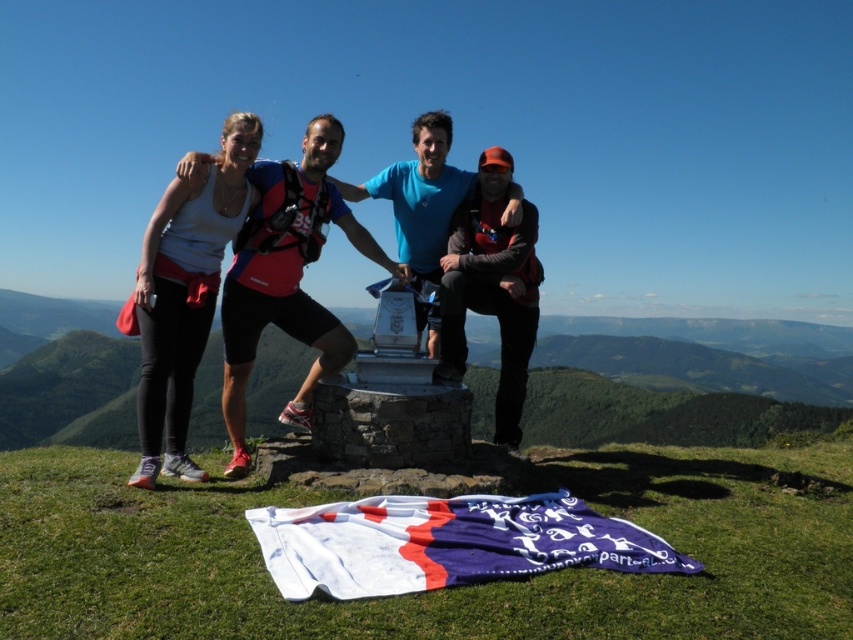
You are a photographer trying to capture a photo of the group. The matte blue shirt at center and the white matte tank top at upper left are in the frame. Which person should you focus on first to ensure they are in focus if you want to capture both?

You should focus on the matte blue shirt at center first because it is closer to the viewer than the white matte tank top at upper left, which is positioned further away.

You are planning to take a photo of the group on the grassy hilltop. The matte blue shirt at center and the white matte tank top at upper left are in your frame. Which person should you adjust to ensure they are both fully visible in the photo?

The matte blue shirt at center might be wider than the white matte tank top at upper left, so you should adjust the matte blue shirt at center to ensure it fits within the frame.

Based on the scene description, where is the silver metallic monument at center located in terms of coordinates?

The silver metallic monument at center is located at coordinates point (672, 392).